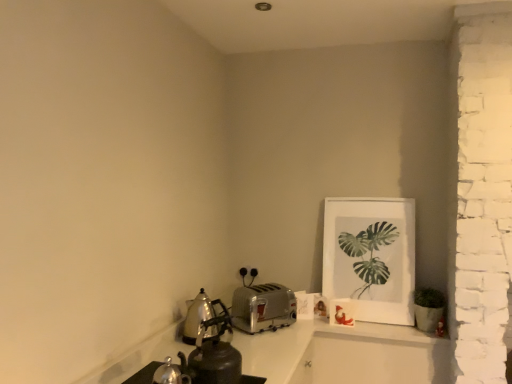
Question: Can you confirm if polished stainless steel kettle at left, which is the first kitchen appliance in left-to-right order, is positioned to the right of shiny metallic kettle at lower left?

Choices:
 (A) no
 (B) yes

Answer: (A)

Question: Could shiny metallic kettle at lower left be considered to be inside polished stainless steel kettle at left, the second kitchen appliance positioned from the right?

Choices:
 (A) no
 (B) yes

Answer: (A)

Question: Can you confirm if polished stainless steel kettle at left, the second kitchen appliance positioned from the right, is taller than shiny metallic kettle at lower left?

Choices:
 (A) yes
 (B) no

Answer: (B)

Question: From the image's perspective, would you say polished stainless steel kettle at left, which is the first kitchen appliance in left-to-right order, is positioned over shiny metallic kettle at lower left?

Choices:
 (A) no
 (B) yes

Answer: (B)

Question: From a real-world perspective, is polished stainless steel kettle at left, which is the first kitchen appliance in left-to-right order, on shiny metallic kettle at lower left?

Choices:
 (A) yes
 (B) no

Answer: (A)

Question: Is polished stainless steel kettle at left, which is the first kitchen appliance in left-to-right order, far away from shiny metallic kettle at lower left?

Choices:
 (A) yes
 (B) no

Answer: (B)

Question: Is the depth of polished stainless steel kettle at left, the second kitchen appliance positioned from the right, less than that of white matte picture frame at upper right?

Choices:
 (A) yes
 (B) no

Answer: (A)

Question: Does polished stainless steel kettle at left, which is the first kitchen appliance in left-to-right order, have a lesser height compared to white matte picture frame at upper right?

Choices:
 (A) no
 (B) yes

Answer: (B)

Question: Considering the relative sizes of polished stainless steel kettle at left, which is the first kitchen appliance in left-to-right order, and white matte picture frame at upper right in the image provided, is polished stainless steel kettle at left, which is the first kitchen appliance in left-to-right order, bigger than white matte picture frame at upper right?

Choices:
 (A) no
 (B) yes

Answer: (A)

Question: Does polished stainless steel kettle at left, which is the first kitchen appliance in left-to-right order, have a greater height compared to white matte picture frame at upper right?

Choices:
 (A) yes
 (B) no

Answer: (B)

Question: Does polished stainless steel kettle at left, the second kitchen appliance positioned from the right, come behind white matte picture frame at upper right?

Choices:
 (A) yes
 (B) no

Answer: (B)

Question: From a real-world perspective, is polished stainless steel kettle at left, which is the first kitchen appliance in left-to-right order, positioned over white matte picture frame at upper right based on gravity?

Choices:
 (A) yes
 (B) no

Answer: (B)

Question: Considering the relative sizes of shiny metallic kettle at lower left and silver metallic toaster at center, the first kitchen appliance viewed from the right, in the image provided, is shiny metallic kettle at lower left wider than silver metallic toaster at center, the first kitchen appliance viewed from the right,?

Choices:
 (A) yes
 (B) no

Answer: (B)